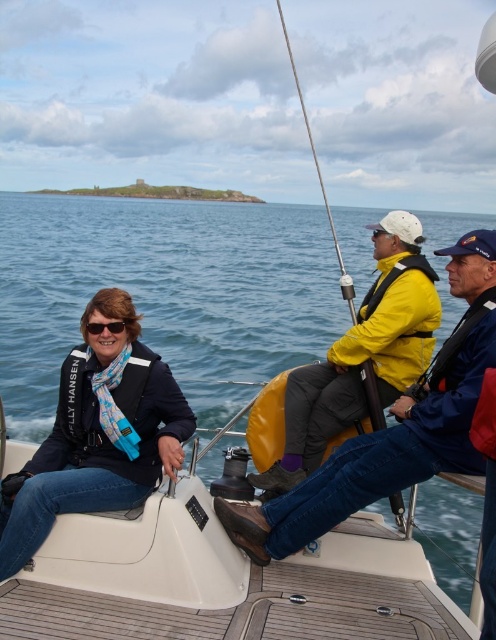
You are standing on the deck of the sailboat and see the blue fabric jacket at lower left. Where is the point at coordinate (98, 435) located relative to the blue fabric jacket at lower left?

The point at coordinate (98, 435) is located at the position of the blue fabric jacket at lower left.

You are a photographer on the deck of the sailboat and want to take a photo of both the blue fabric jacket at lower left and the black plastic goggles at center. To ensure both are in the frame, which object should you position closer to the center of your camera viewfinder?

You should position the black plastic goggles at center closer to the center of your camera viewfinder because the blue fabric jacket at lower left is already to the right of the black plastic goggles at center, so centering the goggles will help keep both objects within the frame.

You are a photographer trying to capture a group photo of the people on the sailboat. You need to arrange the blue fabric jacket at lower left and the yellow matte jacket at center in a line from left to right. Which jacket should be placed first on the left side?

The blue fabric jacket at lower left should be placed first on the left side since it is already positioned on the left side of the yellow matte jacket at center.